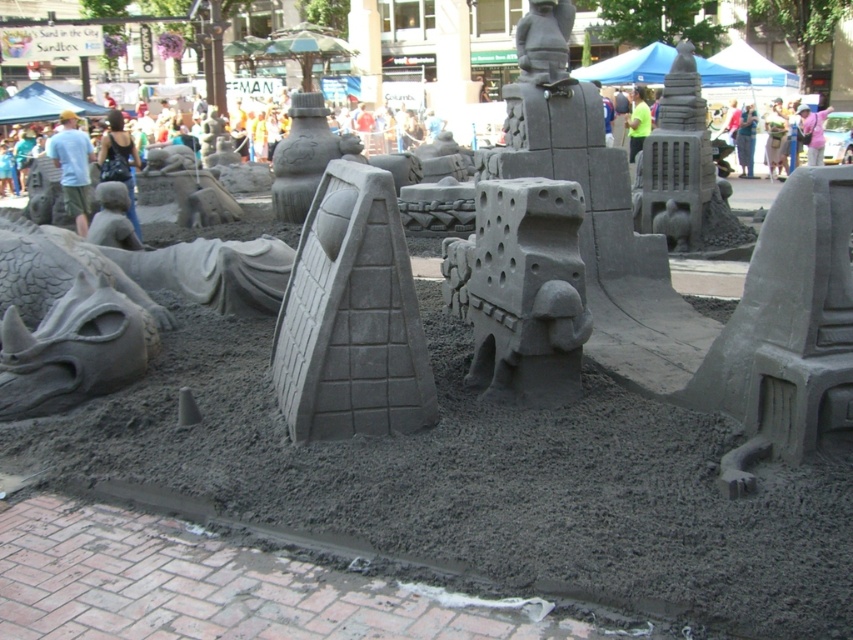
Can you confirm if gray brick wall at center is positioned below gray sandcastle at center?

Yes, gray brick wall at center is below gray sandcastle at center.

Who is higher up, gray brick wall at center or gray sandcastle at center?

Positioned higher is gray sandcastle at center.

Between point (375, 196) and point (556, 192), which one is positioned in front?

Point (375, 196) is more forward.

I want to click on gray brick wall at center, so click(351, 317).

Between gray matte sand sculpture at lower left and gray stone tower at center, which one appears on the right side from the viewer's perspective?

gray stone tower at center

At what (x,y) coordinates should I click in order to perform the action: click on gray matte sand sculpture at lower left. Please return your answer as a coordinate pair (x, y). The image size is (853, 640). Looking at the image, I should click on (62, 323).

In order to click on gray matte sand sculpture at lower left in this screenshot , I will do (62, 323).

Can you confirm if gray brick wall at center is shorter than gray matte sand sculpture at lower left?

In fact, gray brick wall at center may be taller than gray matte sand sculpture at lower left.

The image size is (853, 640). What do you see at coordinates (351, 317) in the screenshot?
I see `gray brick wall at center` at bounding box center [351, 317].

Locate an element on the screen. The height and width of the screenshot is (640, 853). gray brick wall at center is located at coordinates (351, 317).

You are a GUI agent. You are given a task and a screenshot of the screen. Output one action in this format:
    pyautogui.click(x=<x>, y=<y>)
    Task: Click on the gray brick wall at center
    This screenshot has height=640, width=853.
    Given the screenshot: What is the action you would take?
    pyautogui.click(x=351, y=317)